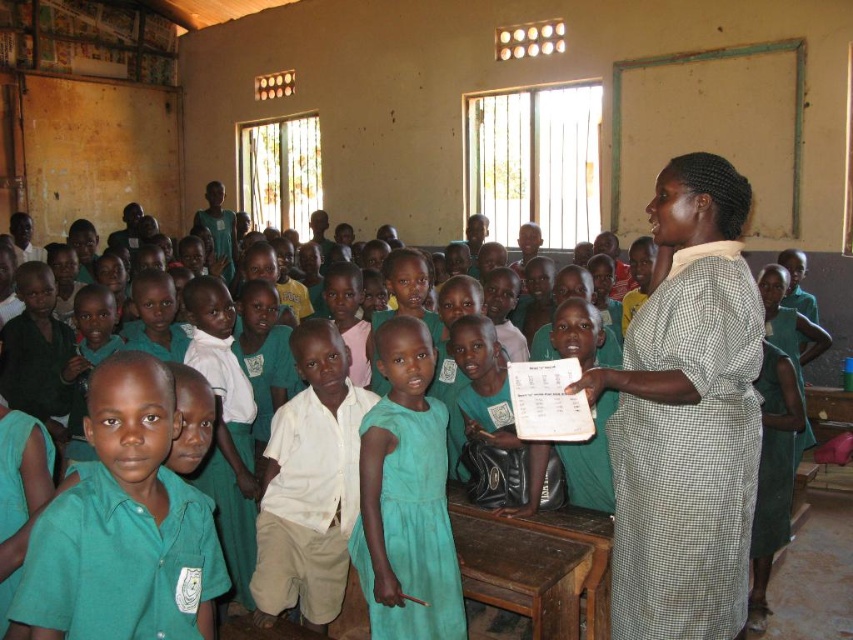
Which is above, checkered fabric dress at right or teal fabric dress at center?

Positioned higher is checkered fabric dress at right.

Can you confirm if checkered fabric dress at right is thinner than teal fabric dress at center?

No, checkered fabric dress at right is not thinner than teal fabric dress at center.

Is point (677, 589) positioned behind point (410, 486)?

No, (677, 589) is closer to viewer.

Identify the location of checkered fabric dress at right. (686, 416).